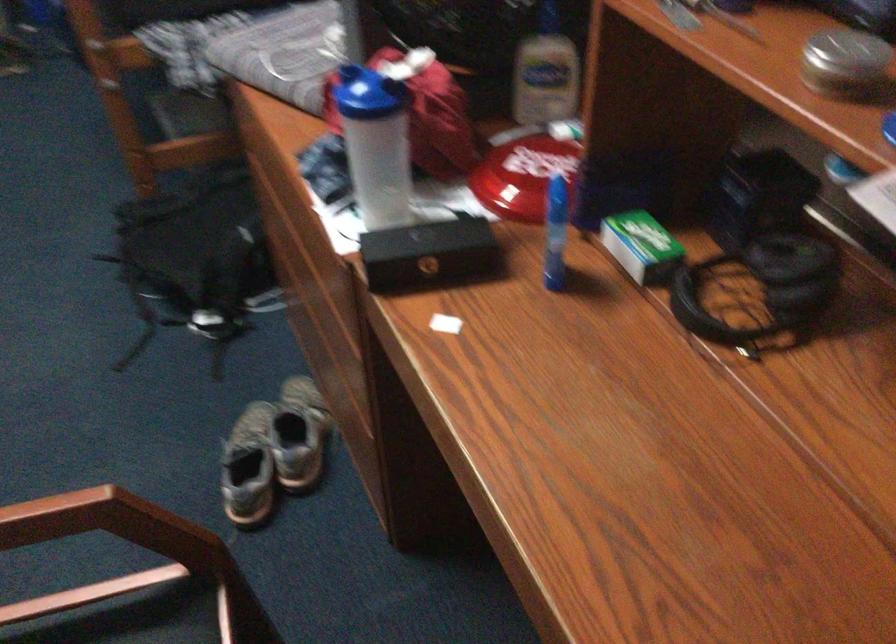
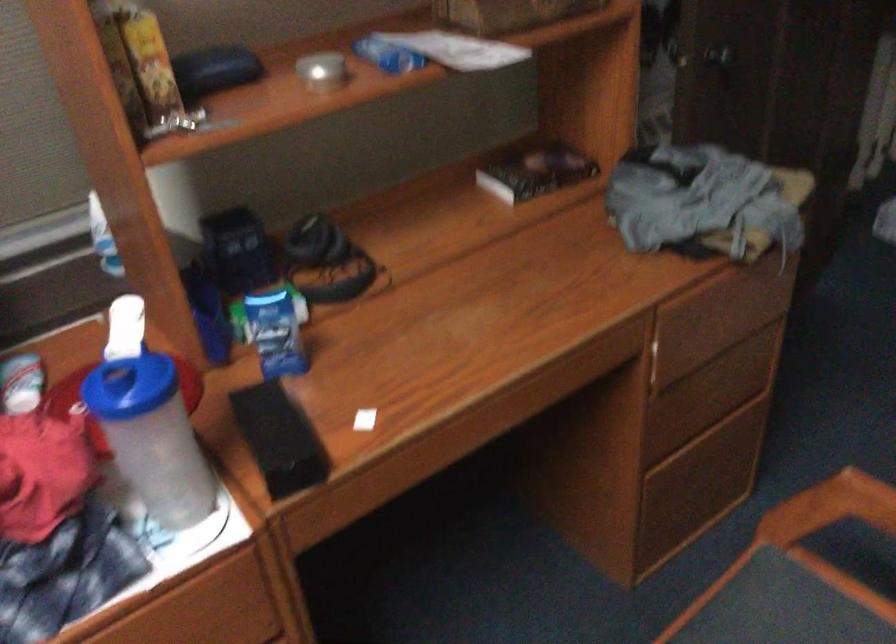
Question: I am providing you with two images of the same scene from different viewpoints. After the viewpoint changes to image2, which objects are now occluded?

Choices:
 (A) blue bottle lid
 (B) blue plastic bottle
 (C) black book
 (D) none of these

Answer: (D)